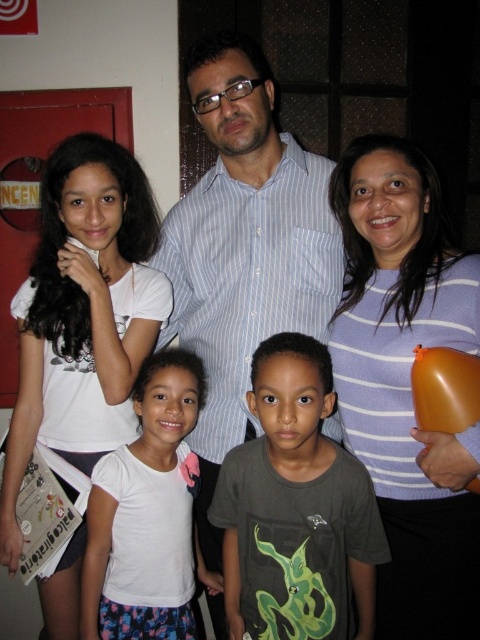
Question: Does blue striped shirt at center appear on the right side of white cotton shirt at upper left?

Choices:
 (A) no
 (B) yes

Answer: (B)

Question: Can you confirm if blue striped shirt at center is positioned to the right of white cotton shirt at upper left?

Choices:
 (A) no
 (B) yes

Answer: (B)

Question: Which is farther from the purple striped sweater at upper right?

Choices:
 (A) dark gray t-shirt at center
 (B) white cotton shirt at upper left

Answer: (B)

Question: Which point appears farthest from the camera in this image?

Choices:
 (A) (120, 600)
 (B) (374, 401)
 (C) (301, 616)

Answer: (A)

Question: Which point is closer to the camera?

Choices:
 (A) dark gray t-shirt at center
 (B) white cotton shirt at upper left

Answer: (A)

Question: Can you confirm if purple striped sweater at upper right is positioned to the left of dark gray t-shirt at center?

Choices:
 (A) no
 (B) yes

Answer: (A)